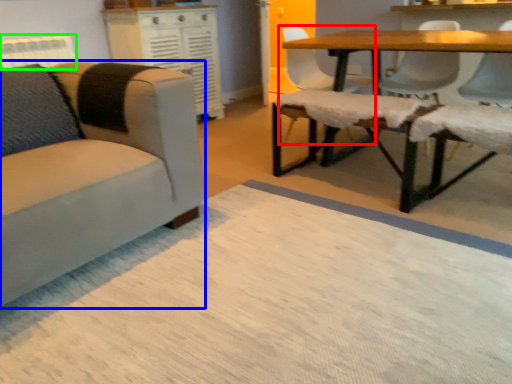
Question: Which is nearer to the chair (highlighted by a red box)? chair (highlighted by a blue box) or radiator (highlighted by a green box).

Choices:
 (A) chair
 (B) radiator

Answer: (A)